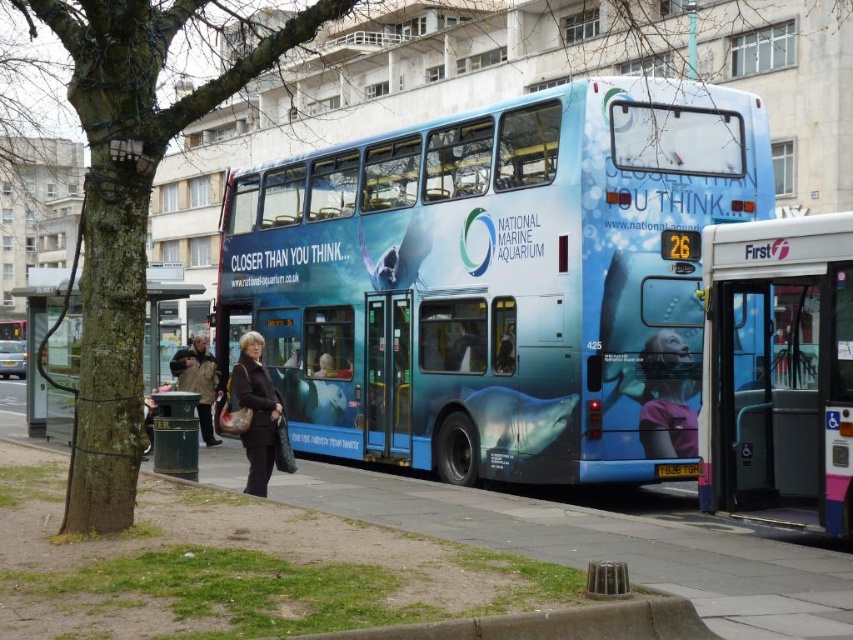
You are standing at the bus stop and want to take a photo of the advertisement on the double decker bus. The bus stop shelter has two points marked as your possible camera positions. The first position is at point (148,360) and the second is at point (669,464). Which point is closer to the front of the bus so you can get a clear shot of the advertisement?

Point (148,360) is behind point (669,464), so the closer point to the front of the bus would be point (669,464).

You are a photographer trying to capture the entire blue glossy bus at center and the black plastic license plate at center in a single frame. Given that the camera can only focus on objects within a 100cm width, will both objects fit in the frame if their combined width is 120cm?

The blue glossy bus at center is wider than the black plastic license plate at center. However, their combined width of 120cm exceeds the camera frame limit of 100cm, so they won

You are a delivery person with a cart that is 2 meters wide. You need to move from the blue glossy bus at center to the green plastic trash can at left. Is there enough space between them for your cart to pass through?

The blue glossy bus at center and the green plastic trash can at left are 4.38 meters apart from each other. Since your cart is 2 meters wide, there is sufficient space between them for your cart to pass through.